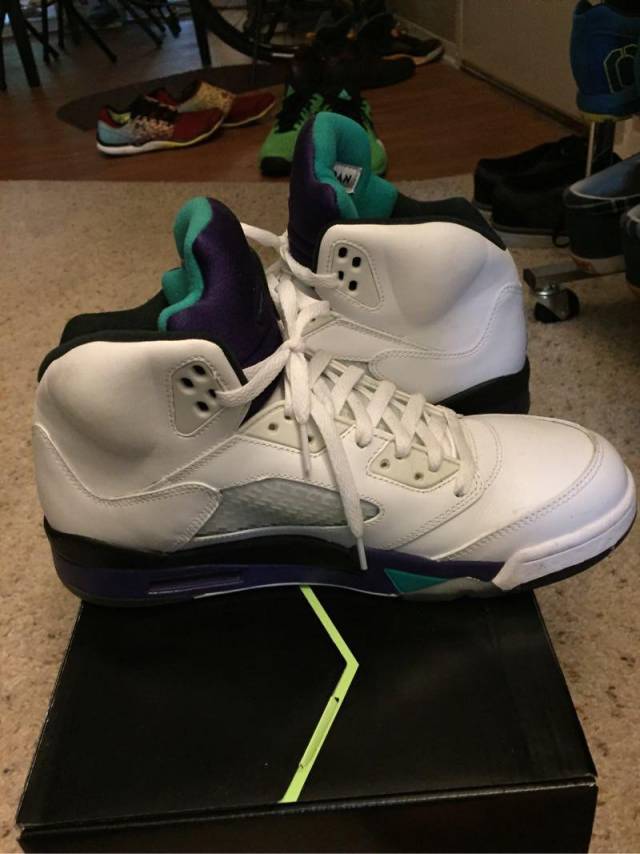
Identify the location of box. The height and width of the screenshot is (854, 640). (415, 739).